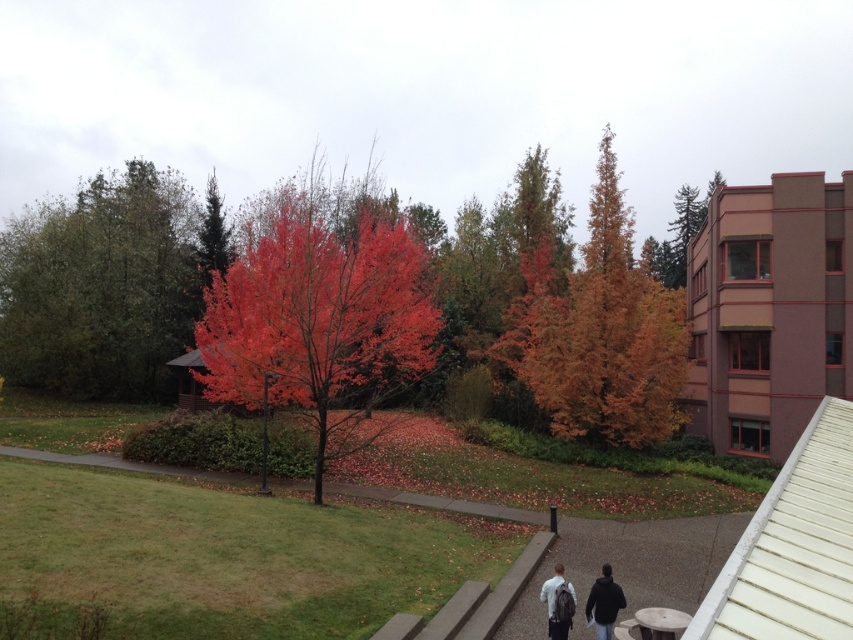
From the picture: Which is below, shiny red leaves at center or orange matte tree at center?

Positioned lower is shiny red leaves at center.

Can you confirm if shiny red leaves at center is wider than orange matte tree at center?

In fact, shiny red leaves at center might be narrower than orange matte tree at center.

Is point (302, 241) behind point (601, 211)?

No, it is in front of (601, 211).

Image resolution: width=853 pixels, height=640 pixels. I want to click on shiny red leaves at center, so click(x=318, y=310).

Is black matte jacket at lower center positioned before light gray backpack at center?

No, it is behind light gray backpack at center.

Which is more to the left, black matte jacket at lower center or light gray backpack at center?

light gray backpack at center

Who is more distant from viewer, (x=599, y=584) or (x=564, y=627)?

The point (x=599, y=584) is behind.

This screenshot has width=853, height=640. In order to click on black matte jacket at lower center in this screenshot , I will do `click(604, 604)`.

Between green matte tree at upper left and dark gray backpack at center, which one appears on the left side from the viewer's perspective?

From the viewer's perspective, green matte tree at upper left appears more on the left side.

Is green matte tree at upper left shorter than dark gray backpack at center?

No, green matte tree at upper left is not shorter than dark gray backpack at center.

What do you see at coordinates (102, 285) in the screenshot?
I see `green matte tree at upper left` at bounding box center [102, 285].

Find the location of a particular element. The image size is (853, 640). green matte tree at upper left is located at coordinates (102, 285).